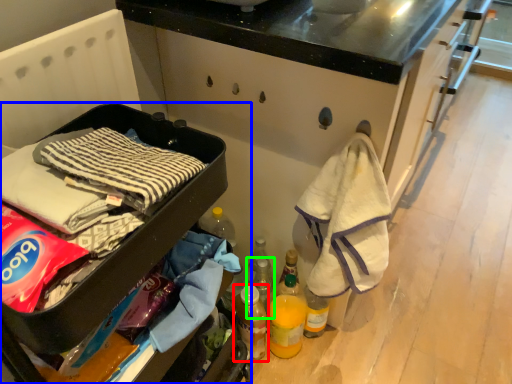
Question: Which object is the farthest from bottle (highlighted by a red box)? Choose among these: furniture (highlighted by a blue box) or bottle (highlighted by a green box).

Choices:
 (A) furniture
 (B) bottle

Answer: (A)